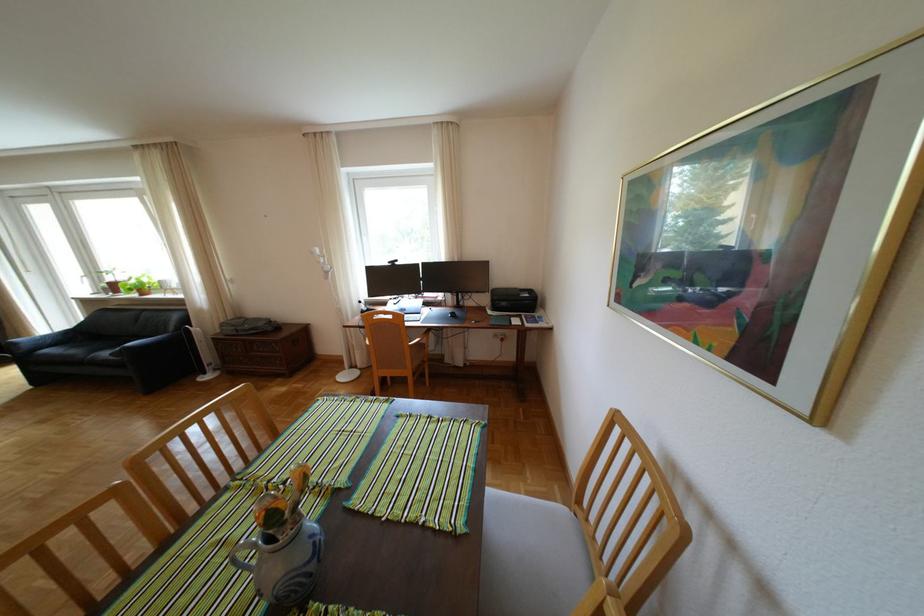
Locate an element on the screen. terracotta flower pot is located at coordinates (111, 280).